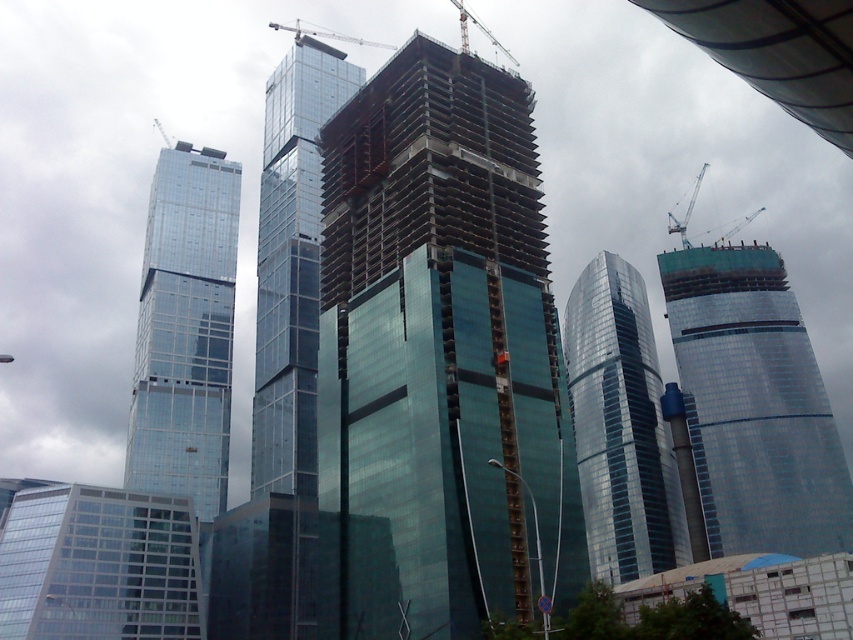
From the picture: You are standing at the base of the central skyscraper and want to take a photo of the point at coordinates point (685,244). If your camera has a maximum focus range of 200 meters, will it be able to focus on that point?

The distance of point (685,244) from viewer is 207.05 meters, which exceeds the camera maximum focus range of 200 meters, so the camera cannot focus on that point.

You are a drone operator tasked with capturing aerial footage of the shiny glass skyscraper at left and the shiny glass skyscraper at center. From your current position above the construction site, which skyscraper would appear closer to you when looking towards them?

The shiny glass skyscraper at left would appear closer to you because it is in front of the shiny glass skyscraper at center, making it visually nearer in the line of sight.

Looking at this image, you are a construction worker standing on the ground floor of the central building. You need to move a heavy beam from the metallic gray crane at upper right to the metallic gray crane at upper center. Can you safely transport it without needing to move the beam horizontally more than 100 meters?

The distance between the metallic gray crane at upper right and the metallic gray crane at upper center is 112.04 meters. Since this exceeds the 100 meters limit, moving the beam horizontally more than 100 meters would be required, so it cannot be done safely without exceeding the limit.